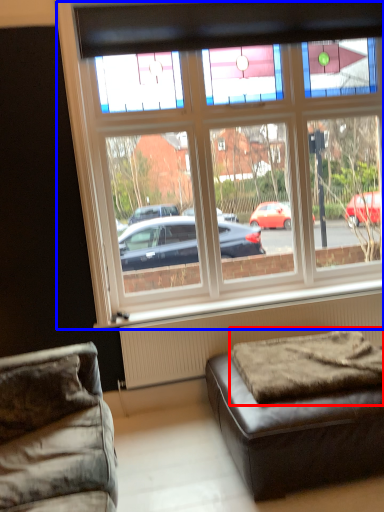
Question: Which of the following is the farthest to the observer, mattress (highlighted by a red box) or window (highlighted by a blue box)?

Choices:
 (A) mattress
 (B) window

Answer: (B)